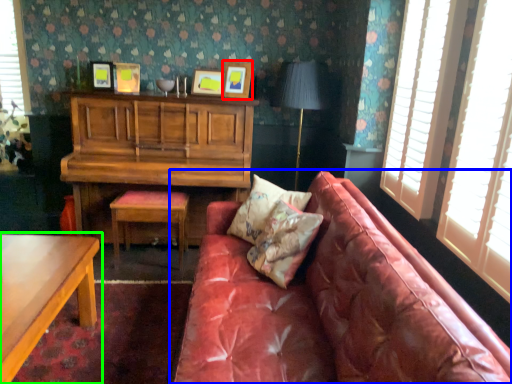
Question: Based on their relative distances, which object is nearer to picture frame (highlighted by a red box)? Choose from studio couch (highlighted by a blue box) and table (highlighted by a green box).

Choices:
 (A) studio couch
 (B) table

Answer: (A)